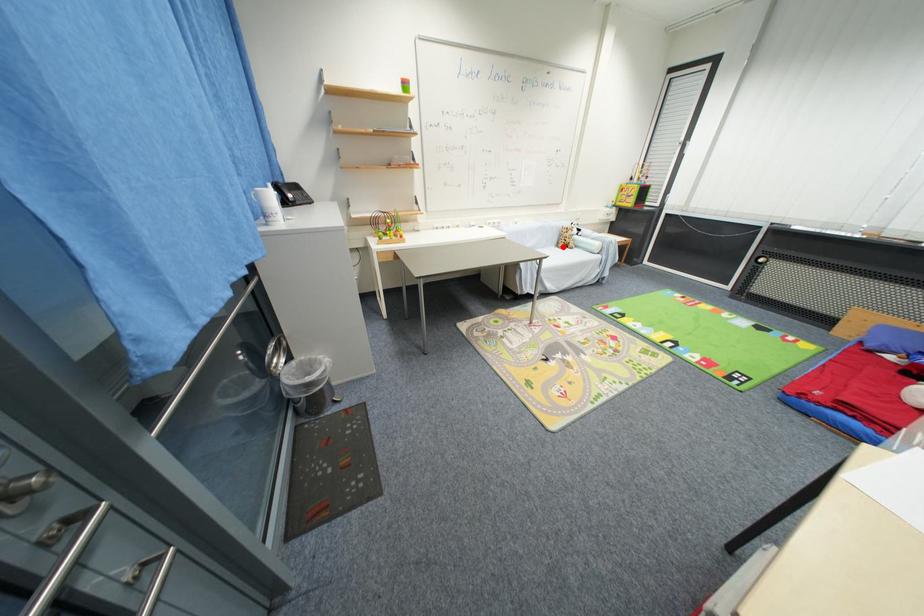
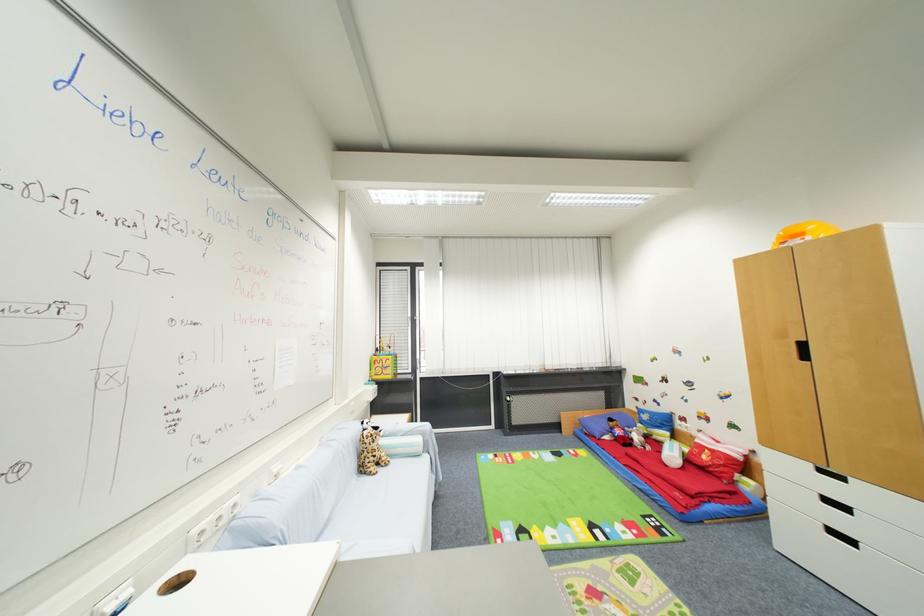
Where in the second image is the point corresponding to the highlighted location from the first image?

(367, 472)